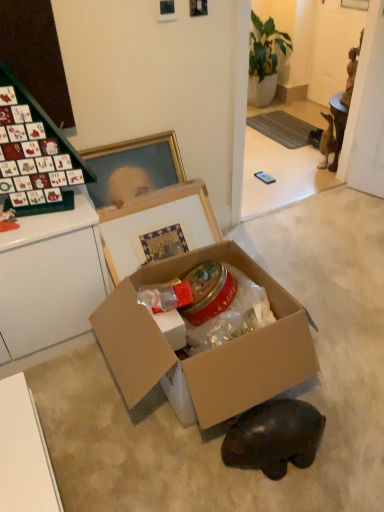
Where is `vacant space that is in between cardboard box at center and shiny black bear at lower center, the 2th animal from the right`? The height and width of the screenshot is (512, 384). vacant space that is in between cardboard box at center and shiny black bear at lower center, the 2th animal from the right is located at coordinates (229, 480).